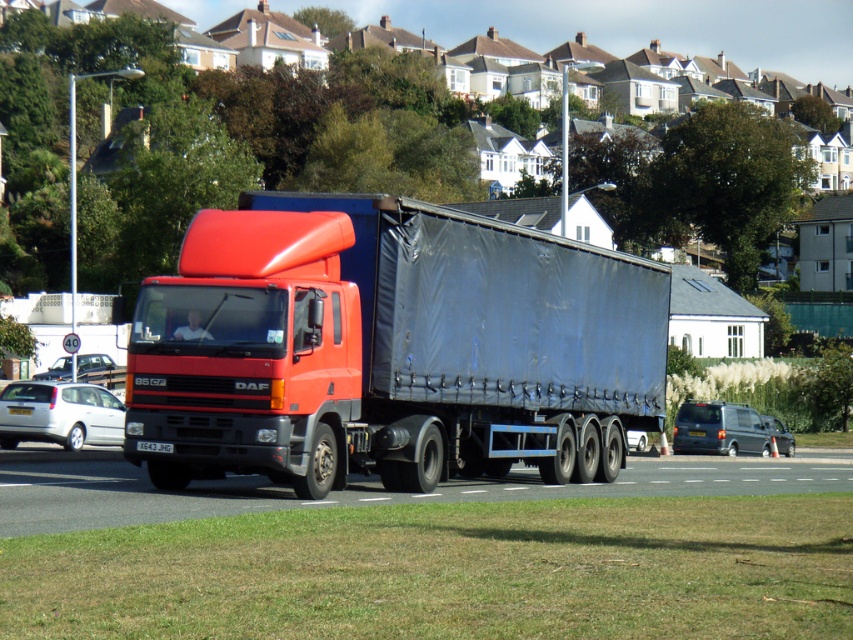
You are a photographer aiming to capture the entire silver metallic hatchback at lower left and black plastic license plate at center in a single shot. Which object requires more horizontal space in the frame?

The silver metallic hatchback at lower left requires more horizontal space in the frame because its width surpasses that of the black plastic license plate at center.